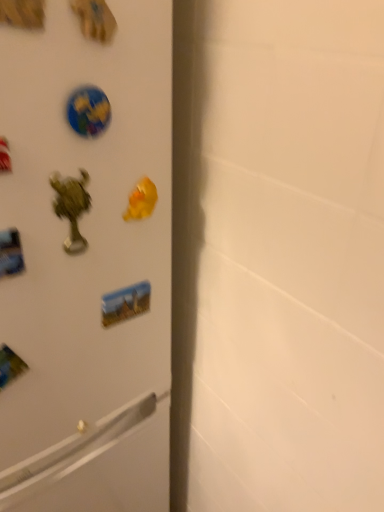
Question: Is white matte refrigerator at left aimed at glossy plastic globe at upper left, marked as the 1th sticker in a top-to-bottom arrangement?

Choices:
 (A) no
 (B) yes

Answer: (B)

Question: Does white matte refrigerator at left have a lesser width compared to glossy plastic globe at upper left, positioned as the 1th sticker in front-to-back order?

Choices:
 (A) yes
 (B) no

Answer: (B)

Question: Does white matte refrigerator at left have a lesser height compared to glossy plastic globe at upper left, the 2th sticker in the bottom-to-top sequence?

Choices:
 (A) yes
 (B) no

Answer: (B)

Question: Would you say white matte refrigerator at left contains glossy plastic globe at upper left, marked as the 1th sticker in a top-to-bottom arrangement?

Choices:
 (A) no
 (B) yes

Answer: (B)

Question: Does white matte refrigerator at left have a larger size compared to glossy plastic globe at upper left, the 2th sticker in the bottom-to-top sequence?

Choices:
 (A) no
 (B) yes

Answer: (B)

Question: From the image's perspective, is matte plastic sticker at center, the 2th sticker positioned from the front, positioned above or below glossy plastic globe at upper left, acting as the 2th sticker starting from the back?

Choices:
 (A) below
 (B) above

Answer: (A)

Question: Is point (124, 310) positioned closer to the camera than point (96, 98)?

Choices:
 (A) farther
 (B) closer

Answer: (A)

Question: From a real-world perspective, is matte plastic sticker at center, positioned as the 1th sticker in back-to-front order, physically located above or below glossy plastic globe at upper left, marked as the 1th sticker in a top-to-bottom arrangement?

Choices:
 (A) below
 (B) above

Answer: (A)

Question: Is matte plastic sticker at center, the 2th sticker positioned from the front, in front of or behind glossy plastic globe at upper left, positioned as the 1th sticker in front-to-back order, in the image?

Choices:
 (A) front
 (B) behind

Answer: (B)

Question: Choose the correct answer: Is white matte refrigerator at left inside gold metallic magnet at center or outside it?

Choices:
 (A) inside
 (B) outside

Answer: (B)

Question: From their relative heights in the image, would you say white matte refrigerator at left is taller or shorter than gold metallic magnet at center?

Choices:
 (A) short
 (B) tall

Answer: (B)

Question: Is white matte refrigerator at left wider or thinner than gold metallic magnet at center?

Choices:
 (A) wide
 (B) thin

Answer: (A)

Question: From the image's perspective, relative to gold metallic magnet at center, is white matte refrigerator at left above or below?

Choices:
 (A) below
 (B) above

Answer: (A)

Question: Would you say gold metallic magnet at center is to the left or to the right of matte plastic sticker at center, the 2th sticker positioned from the front, in the picture?

Choices:
 (A) left
 (B) right

Answer: (B)

Question: Considering the positions of gold metallic magnet at center and matte plastic sticker at center, positioned as the 1th sticker in back-to-front order, in the image, is gold metallic magnet at center taller or shorter than matte plastic sticker at center, positioned as the 1th sticker in back-to-front order,?

Choices:
 (A) tall
 (B) short

Answer: (B)